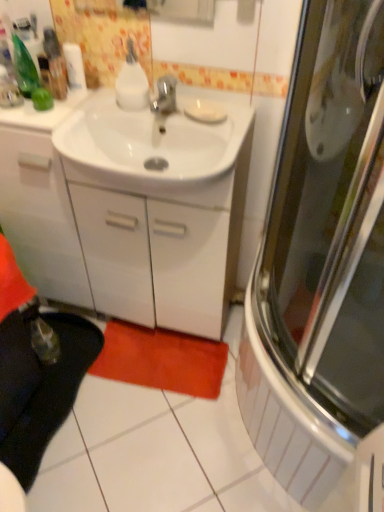
This screenshot has width=384, height=512. Find the location of `free spot in front of translucent plastic bottle at upper left, positioned as the second bottle in right-to-left order`. free spot in front of translucent plastic bottle at upper left, positioned as the second bottle in right-to-left order is located at coordinates (51, 120).